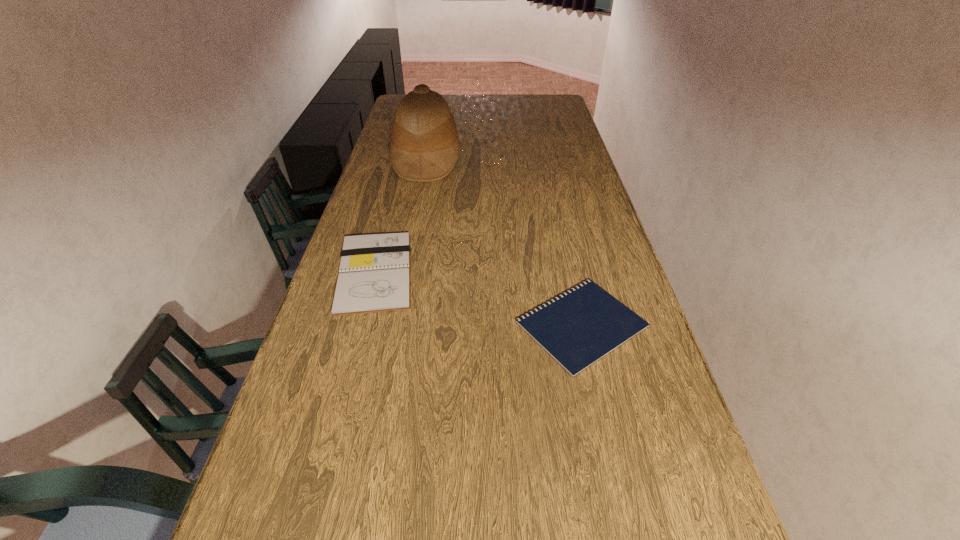
At what (x,y) coordinates should I click in order to perform the action: click on free spot that satisfies the following two spatial constraints: 1. on the back side of the shortest object; 2. on the front-facing side of the tallest object. Please return your answer as a coordinate pair (x, y). This screenshot has width=960, height=540. Looking at the image, I should click on (544, 160).

Where is `vacant space that satisfies the following two spatial constraints: 1. on the front-facing side of the farthest object; 2. on the front side of the taller notepad`? vacant space that satisfies the following two spatial constraints: 1. on the front-facing side of the farthest object; 2. on the front side of the taller notepad is located at coordinates (405, 273).

Locate an element on the screen. The width and height of the screenshot is (960, 540). free spot that satisfies the following two spatial constraints: 1. on the front-facing side of the right notepad; 2. on the left side of the tallest object is located at coordinates (396, 325).

The height and width of the screenshot is (540, 960). I want to click on free space that satisfies the following two spatial constraints: 1. on the front-facing side of the farthest object; 2. on the left side of the rightmost object, so click(x=396, y=325).

I want to click on vacant region that satisfies the following two spatial constraints: 1. on the front side of the second shortest object; 2. on the right side of the rightmost object, so click(x=361, y=325).

Find the location of `free space in the image that satisfies the following two spatial constraints: 1. on the front side of the second shortest object; 2. on the right side of the shorter notepad`. free space in the image that satisfies the following two spatial constraints: 1. on the front side of the second shortest object; 2. on the right side of the shorter notepad is located at coordinates (361, 325).